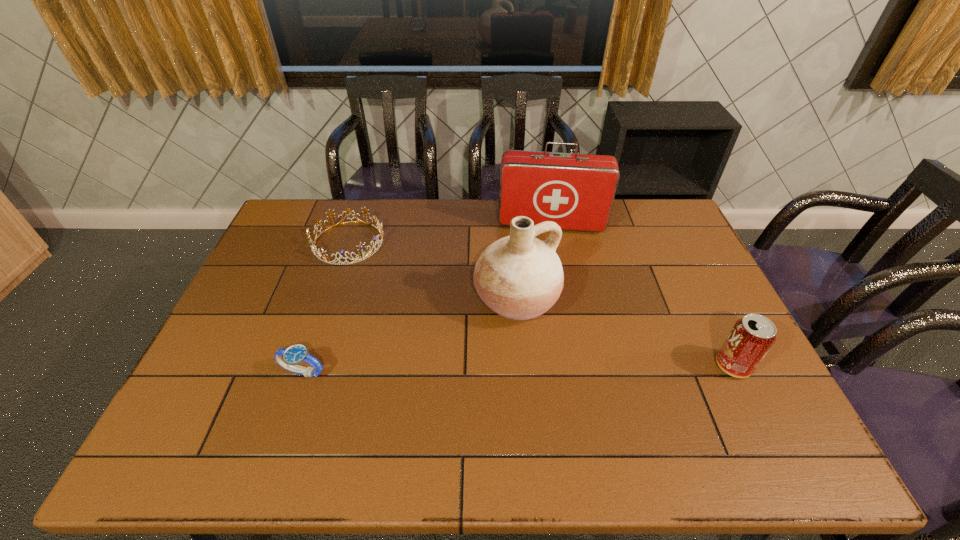
Locate an element on the screen. free point that satisfies the following two spatial constraints: 1. on the front side of the tiara; 2. on the right side of the soda can is located at coordinates (307, 366).

Locate an element on the screen. free spot that satisfies the following two spatial constraints: 1. on the front side of the first-aid kit; 2. on the left side of the soda can is located at coordinates (578, 366).